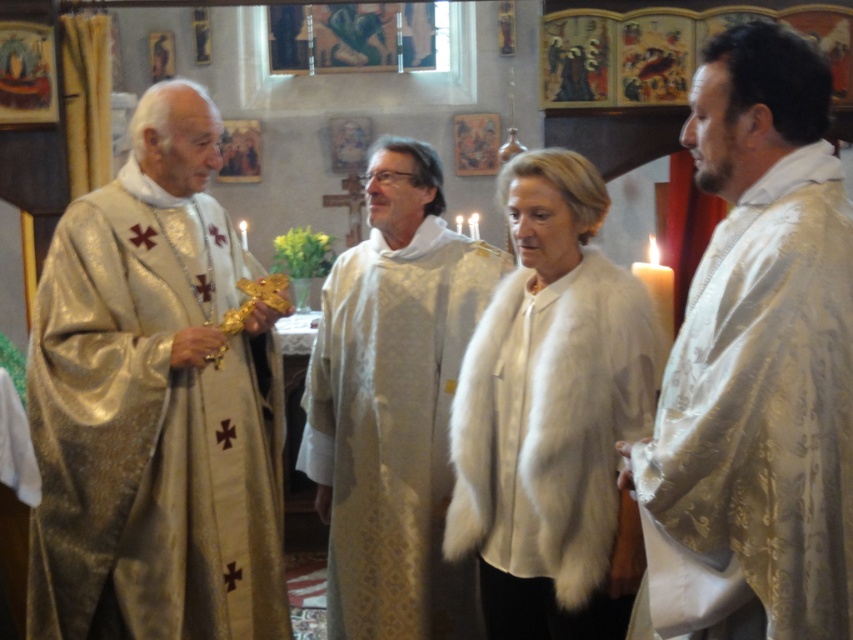
Measure the distance from shiny gold robe at left to white fur coat at center.

shiny gold robe at left is 37.81 inches from white fur coat at center.

Where is `shiny gold robe at left`? This screenshot has height=640, width=853. shiny gold robe at left is located at coordinates (154, 404).

Does point (38, 324) lie behind point (618, 424)?

Yes, point (38, 324) is farther from viewer.

The image size is (853, 640). Identify the location of shiny gold robe at left. (154, 404).

Does silky gold robe at right appear under white fur coat at center?

Incorrect, silky gold robe at right is not positioned below white fur coat at center.

Is point (773, 529) positioned after point (479, 584)?

No.

At what (x,y) coordinates should I click in order to perform the action: click on silky gold robe at right. Please return your answer as a coordinate pair (x, y). This screenshot has width=853, height=640. Looking at the image, I should click on (756, 365).

Is point (462, 387) more distant than point (360, 321)?

No, (462, 387) is closer to viewer.

Who is higher up, white fur coat at center or silky gold robe at center?

white fur coat at center

Who is more forward, (483, 442) or (421, 440)?

Point (483, 442)

You are a GUI agent. You are given a task and a screenshot of the screen. Output one action in this format:
    pyautogui.click(x=<x>, y=<y>)
    Task: Click on the white fur coat at center
    This screenshot has height=640, width=853.
    Given the screenshot: What is the action you would take?
    pyautogui.click(x=553, y=417)